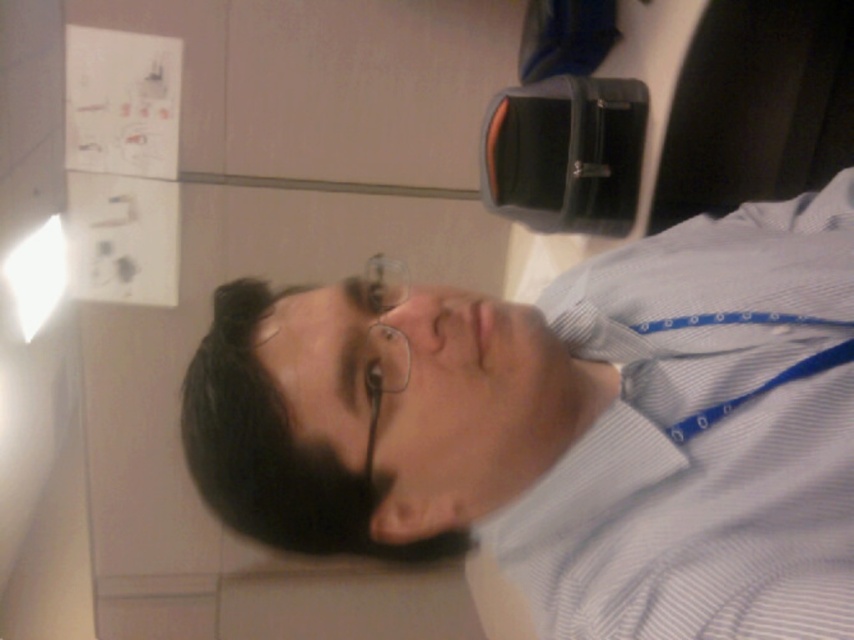
Measure the distance between white striped dress shirt at center and clear plastic glasses at center.

white striped dress shirt at center and clear plastic glasses at center are 3.42 feet apart.

Is point (535, 620) positioned behind point (371, 333)?

Yes, it is.

Find the location of a particular element. The width and height of the screenshot is (854, 640). white striped dress shirt at center is located at coordinates click(703, 436).